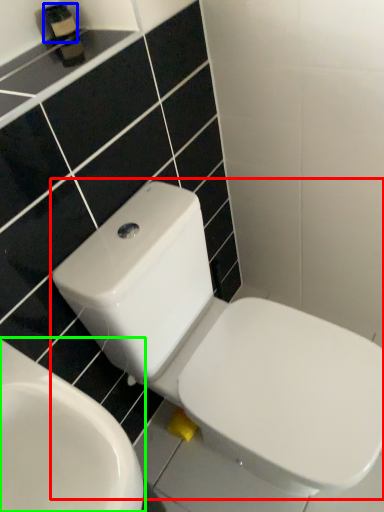
Question: Considering the real-world distances, which object is farthest from toilet (highlighted by a red box)? toiletry (highlighted by a blue box) or toilet (highlighted by a green box)?

Choices:
 (A) toiletry
 (B) toilet

Answer: (A)